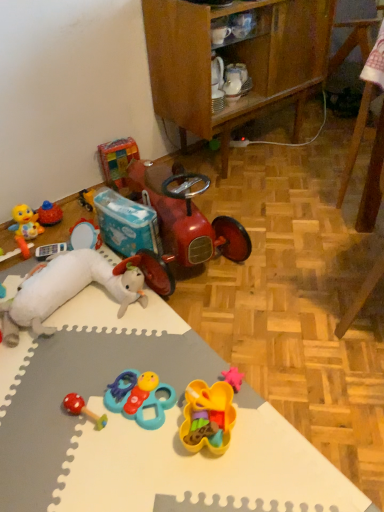
Locate an element on the screen. vacant space behind rubberized red mushroom rattle at lower left, the 2th toy in the front-to-back sequence is located at coordinates (93, 366).